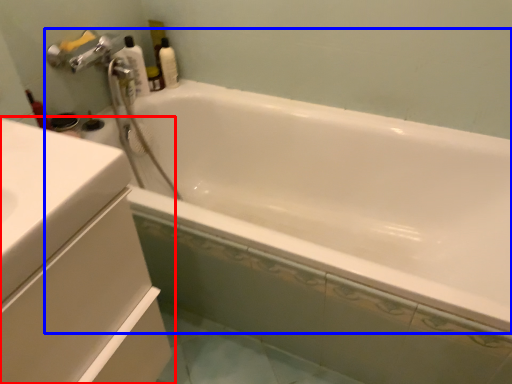
Question: Which of the following is the farthest to the observer, bathroom cabinet (highlighted by a red box) or bathtub (highlighted by a blue box)?

Choices:
 (A) bathroom cabinet
 (B) bathtub

Answer: (B)